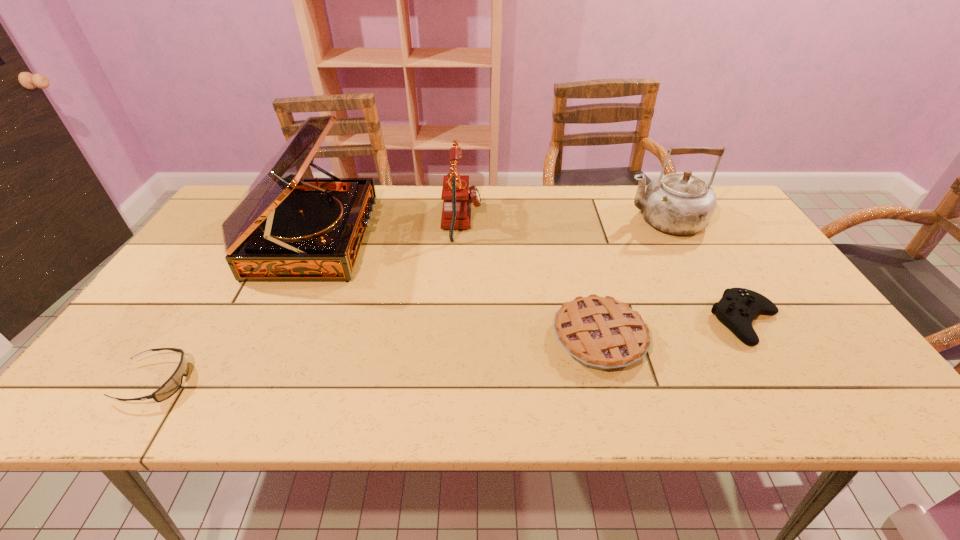
This screenshot has height=540, width=960. I want to click on free point at the right edge, so click(x=786, y=284).

I want to click on vacant region between the control and the goggles, so click(451, 352).

Locate an element on the screen. free spot between the goggles and the telephone is located at coordinates (309, 301).

At what (x,y) coordinates should I click in order to perform the action: click on free spot between the goggles and the record player. Please return your answer as a coordinate pair (x, y). The height and width of the screenshot is (540, 960). Looking at the image, I should click on (235, 310).

Where is `free space between the control and the third tallest object`? free space between the control and the third tallest object is located at coordinates (604, 271).

At what (x,y) coordinates should I click in order to perform the action: click on vacant space that's between the pie and the tallest object. Please return your answer as a coordinate pair (x, y). Looking at the image, I should click on pyautogui.click(x=457, y=288).

Locate an element on the screen. Image resolution: width=960 pixels, height=540 pixels. vacant point located between the tallest object and the goggles is located at coordinates (235, 310).

Where is `free spot between the tallest object and the control`? This screenshot has width=960, height=540. free spot between the tallest object and the control is located at coordinates (531, 279).

Where is `free space between the goggles and the record player`? free space between the goggles and the record player is located at coordinates click(235, 310).

Identify the location of blank region between the control and the goggles. This screenshot has height=540, width=960. (451, 352).